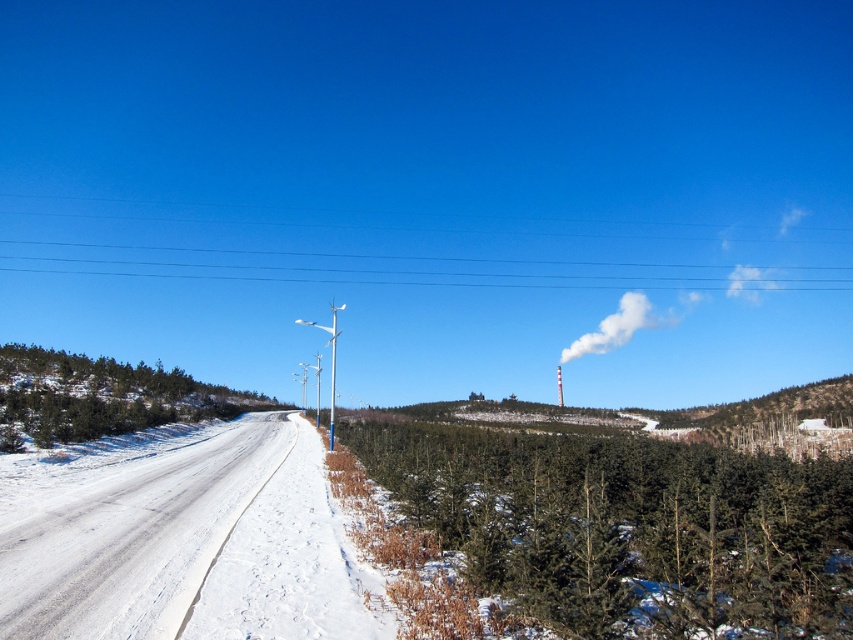
Measure the distance between clear blue wires at upper center and white plastic streetlight at center.

They are 81.67 meters apart.

Between point (24, 259) and point (329, 436), which one is positioned in front?

Point (329, 436) is more forward.

In order to click on clear blue wires at upper center in this screenshot , I will do `click(410, 264)`.

Does green matte tree at lower right appear under white plastic streetlight at center?

Incorrect, green matte tree at lower right is not positioned below white plastic streetlight at center.

Does green matte tree at lower right come in front of white plastic streetlight at center?

Yes, it is.

Identify the location of green matte tree at lower right. The image size is (853, 640). (x=628, y=528).

Which of these two, green matte tree at left or white plastic streetlight at center, stands taller?

white plastic streetlight at center

Measure the distance from green matte tree at left to white plastic streetlight at center.

green matte tree at left and white plastic streetlight at center are 26.31 meters apart from each other.

The height and width of the screenshot is (640, 853). Find the location of `green matte tree at left`. green matte tree at left is located at coordinates (103, 396).